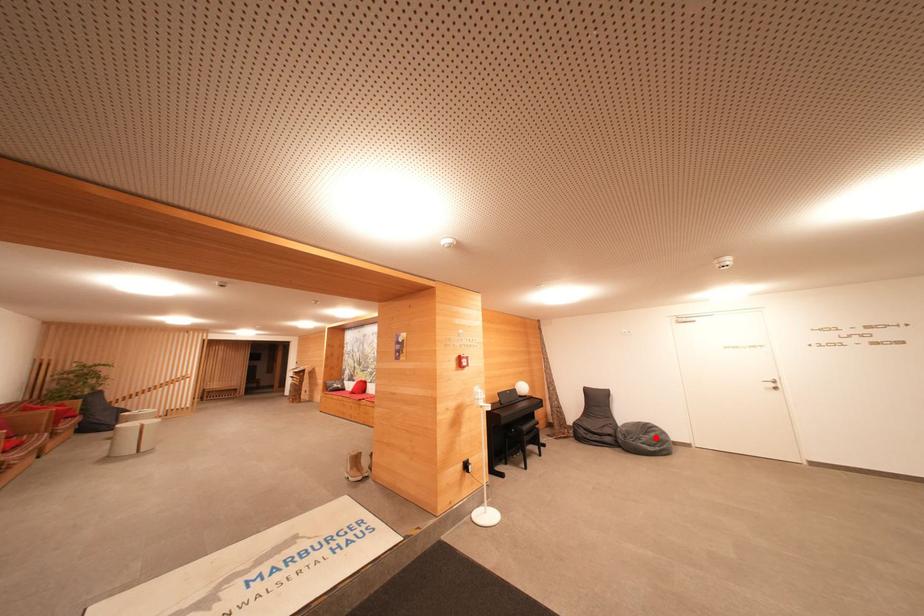
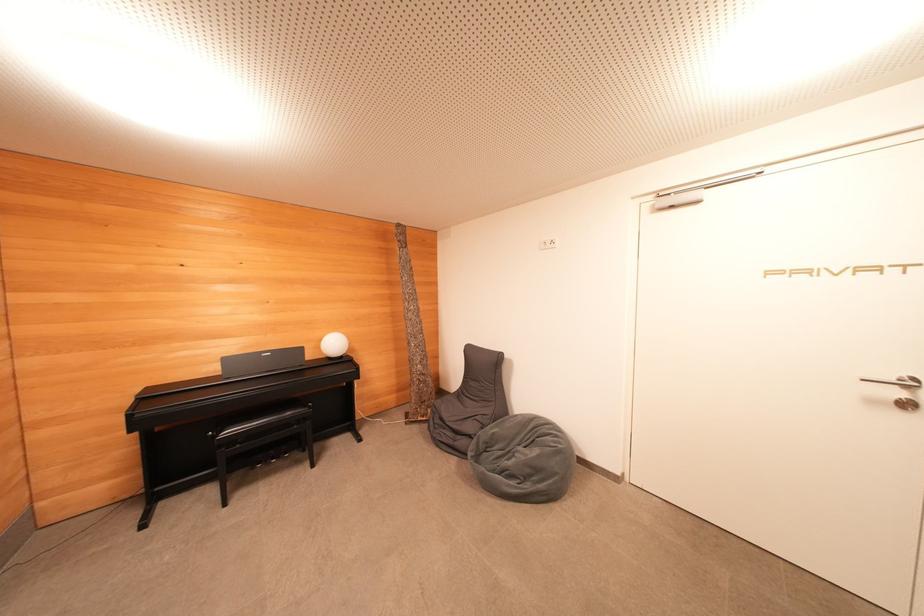
Question: I am providing you with two images of the same scene from different viewpoints. A red point is marked on the first image. Is the red point's position out of view in image 2?

Choices:
 (A) Yes
 (B) No

Answer: (B)